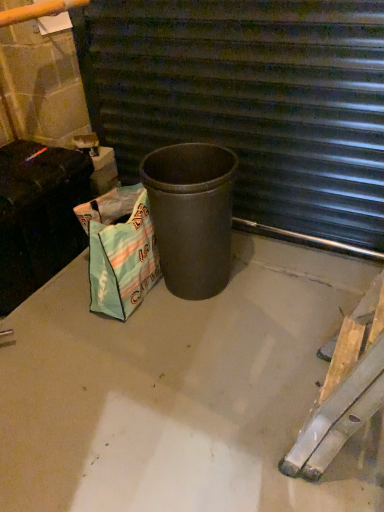
Question: Considering the positions of point (233, 465) and point (160, 204), is point (233, 465) closer or farther from the camera than point (160, 204)?

Choices:
 (A) closer
 (B) farther

Answer: (A)

Question: From the image's perspective, is smooth concrete at center located above or below matte black trash can at center?

Choices:
 (A) below
 (B) above

Answer: (A)

Question: Which object is positioned closest to the matte black trash can at center?

Choices:
 (A) matte black trash can at center
 (B) smooth concrete at center
 (C) textured green shopping bag at lower left

Answer: (C)

Question: Which of these objects is positioned closest to the smooth concrete at center?

Choices:
 (A) matte black trash can at center
 (B) matte black trash can at center
 (C) textured green shopping bag at lower left

Answer: (C)